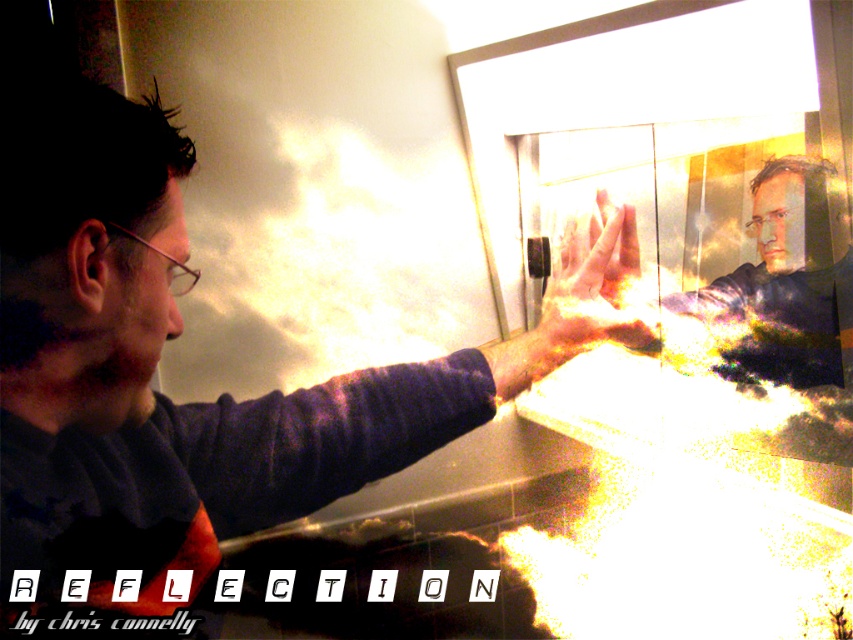
Based on the photo, you are trying to determine if the matte black face at upper right in the mirror can fit entirely within the frame of the translucent glass hand at center. Based on their sizes, is this possible?

The matte black face at upper right might be wider than translucent glass hand at center, so it is possible that the face cannot fit entirely within the hand frame due to its potential larger width.

You are standing in the bathroom and see two points marked on the mirror. The first point is at coordinates point (844, 307) and the second is at point (604, 225). According to the reflection, which point is closer to you?

Point (604, 225) is closer to you because in the mirror reflection, objects further away from the mirror appear closer to the viewer. Since point (844, 307) is behind point (604, 225), it means point (604, 225) is nearer to your position.